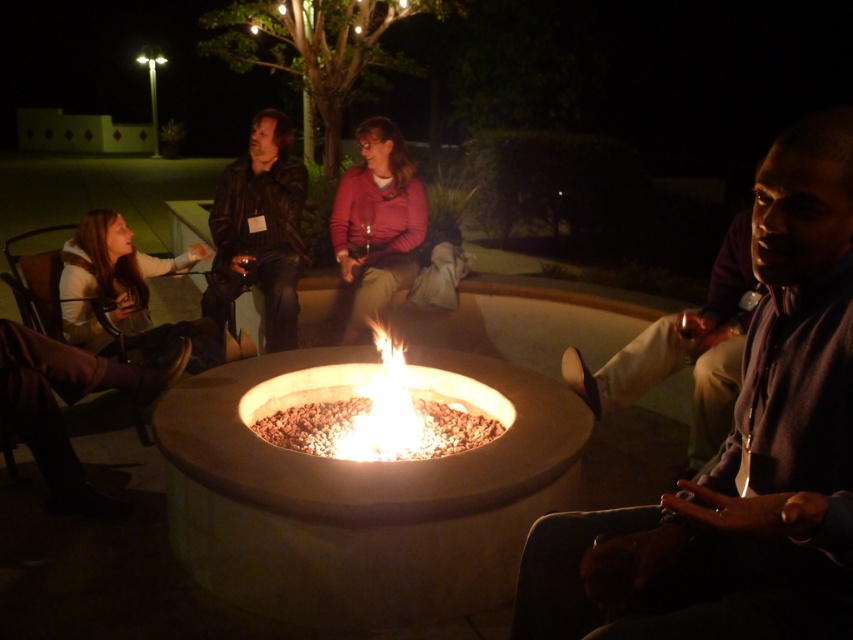
You are standing at the edge of the fire pit and want to hand a marshmallow to the person wearing the dark blue shirt at center. Based on their position relative to you, in which general direction should you walk to reach them?

The dark blue shirt at center is located at point 0.709 on the x and 0.869 on the y axis, so you should walk towards the upper right direction to reach them.